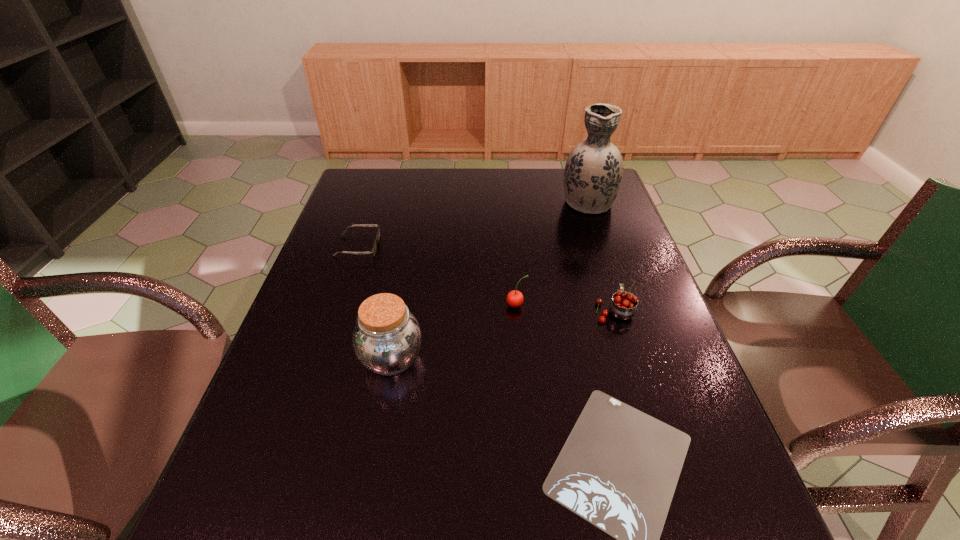
At what (x,y) coordinates should I click in order to perform the action: click on free location located 0.160m on the handle side of the right cherry. Please return your answer as a coordinate pair (x, y). The image size is (960, 540). Looking at the image, I should click on (597, 258).

Find the location of a particular element. The width and height of the screenshot is (960, 540). vacant space located 0.290m on the handle side of the right cherry is located at coordinates (589, 230).

Locate an element on the screen. The height and width of the screenshot is (540, 960). vacant space located on the left of the left cherry is located at coordinates (395, 305).

Where is `vacant space situated 0.310m on the front-facing side of the sunglasses`? This screenshot has height=540, width=960. vacant space situated 0.310m on the front-facing side of the sunglasses is located at coordinates pyautogui.click(x=486, y=246).

Locate an element on the screen. object that is positioned at the far edge is located at coordinates (593, 172).

Identify the location of object at the left edge. (373, 251).

Where is `vase at the right edge`? This screenshot has width=960, height=540. vase at the right edge is located at coordinates (593, 172).

Find the location of `cherry at the right edge`. cherry at the right edge is located at coordinates (623, 305).

You are a GUI agent. You are given a task and a screenshot of the screen. Output one action in this format:
    pyautogui.click(x=<x>, y=<y>)
    Task: Click on the object positioned at the far right corner
    The height and width of the screenshot is (540, 960).
    Given the screenshot: What is the action you would take?
    pyautogui.click(x=593, y=172)

Locate an element on the screen. Image resolution: width=960 pixels, height=540 pixels. free region at the far edge of the desktop is located at coordinates (462, 187).